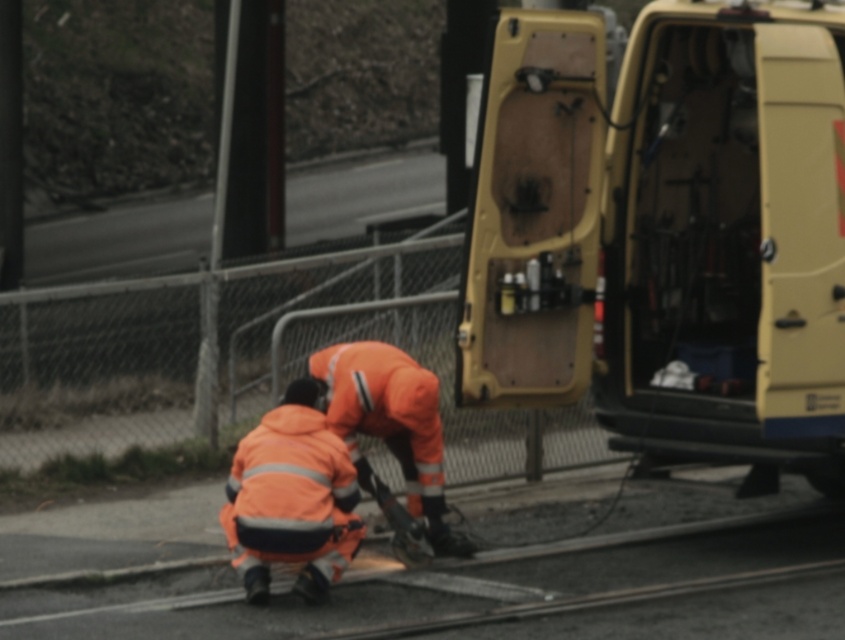
You are a worker needing to access the tools inside the beige matte van door at center. However, there is an orange reflective jacket at lower center in the way. Can you easily reach the van door without moving the jacket?

The orange reflective jacket at lower center is behind the beige matte van door at center, so you can easily reach the beige matte van door at center without needing to move the jacket.